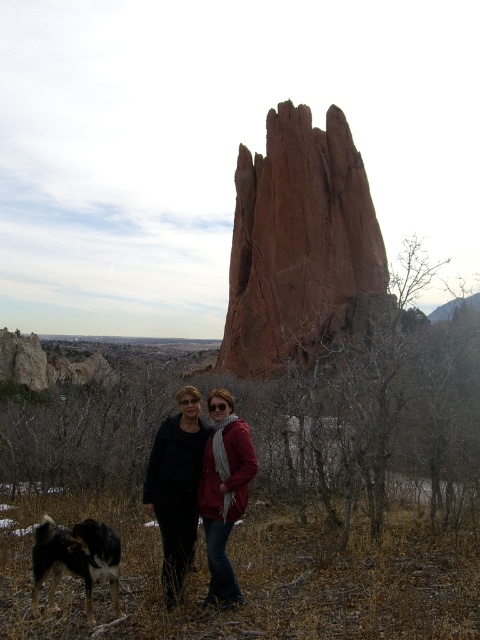
In the image, there are two people standing in front of a red rock formation. One person is wearing a matte black jacket at center and the other is wearing a red jacket with a scarf. Which of the two people is positioned exactly at the coordinates point (177,484)?

The person wearing the matte black jacket at center is positioned exactly at the coordinates point (177,484).